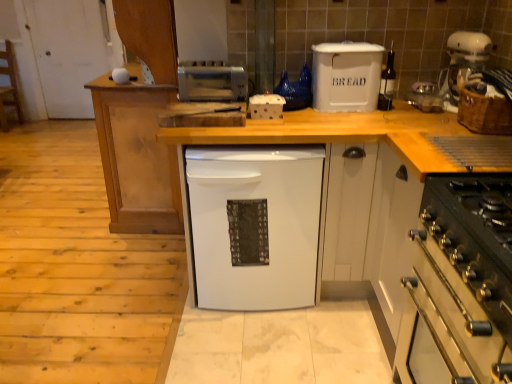
At what (x,y) coordinates should I click in order to perform the action: click on free space between matte white wine bottle at center, the second appliance when ordered from right to left, and woven brown basket at right. Please return your answer as a coordinate pair (x, y). The image size is (512, 384). Looking at the image, I should click on pos(422,120).